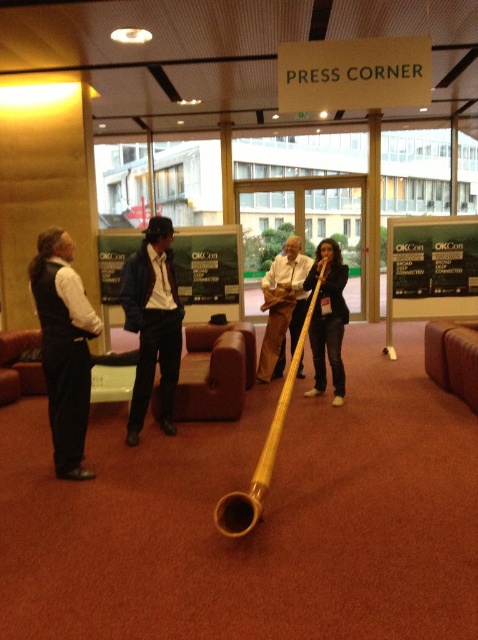
You are standing in the conference room and notice the matte black vest at left and the natural wood pipe at center. Which object is positioned higher from the ground?

The matte black vest at left is located above the natural wood pipe at center, so it is positioned higher from the ground.

You are a photographer setting up a shoot in this room. You need to position a light source so that it illuminates both the matte black vest at left and the wooden horn at center without casting harsh shadows. Given their height difference, where should you place the light source relative to them?

Since the matte black vest at left is much taller than the wooden horn at center, placing the light source above and slightly behind the taller matte black vest at left would ensure both objects receive even lighting while minimizing harsh shadows.